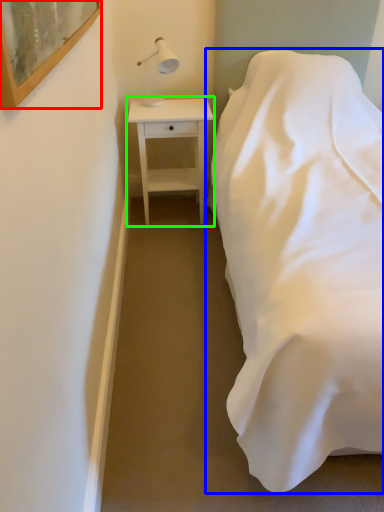
Question: Which object is positioned farthest from picture frame (highlighted by a red box)? Select from bed (highlighted by a blue box) and nightstand (highlighted by a green box).

Choices:
 (A) bed
 (B) nightstand

Answer: (B)